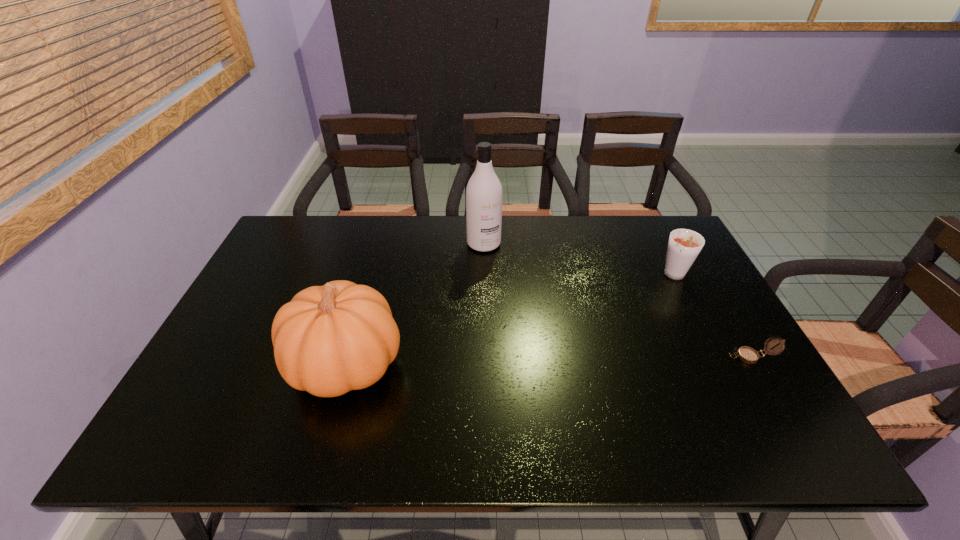
The image size is (960, 540). Identify the location of free spot between the second farthest object and the farthest object. (580, 260).

Where is `blank region between the leftmost object and the second object from left to right`? The height and width of the screenshot is (540, 960). blank region between the leftmost object and the second object from left to right is located at coordinates (415, 304).

Find the location of a particular element. Image resolution: width=960 pixels, height=540 pixels. vacant area that lies between the shortest object and the root beer is located at coordinates point(713,316).

In order to click on free space between the farthest object and the third tallest object in this screenshot , I will do `click(580, 260)`.

Locate an element on the screen. The height and width of the screenshot is (540, 960). vacant area that lies between the third shortest object and the compass is located at coordinates [548, 361].

This screenshot has height=540, width=960. I want to click on free space that is in between the second tallest object and the farthest object, so click(415, 304).

This screenshot has width=960, height=540. Identify the location of the third closest object to the root beer. (328, 340).

I want to click on object that is the third nearest to the root beer, so click(328, 340).

Identify the location of free space that satisfies the following two spatial constraints: 1. on the front side of the compass; 2. on the face of the tallest object. pyautogui.click(x=485, y=357).

At what (x,y) coordinates should I click in order to perform the action: click on free region that satisfies the following two spatial constraints: 1. on the front side of the compass; 2. on the face of the third nearest object. Please return your answer as a coordinate pair (x, y). The image size is (960, 540). Looking at the image, I should click on (717, 357).